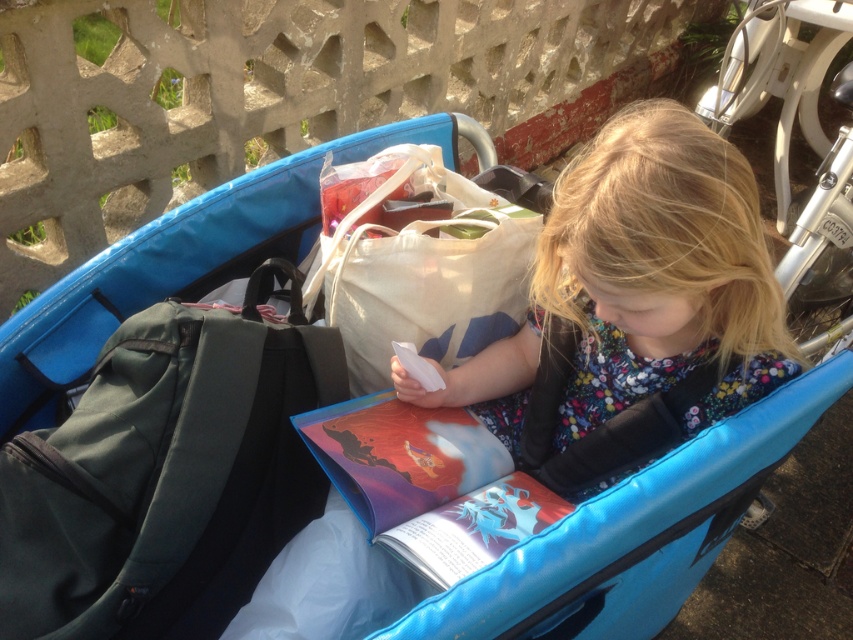
Who is shorter, dark green fabric backpack at left or hardcover book at center?

With less height is hardcover book at center.

Does dark green fabric backpack at left appear under hardcover book at center?

Actually, dark green fabric backpack at left is above hardcover book at center.

Is point (204, 573) positioned in front of point (329, 454)?

That is True.

Where is `dark green fabric backpack at left`? The height and width of the screenshot is (640, 853). dark green fabric backpack at left is located at coordinates (167, 476).

Can you confirm if canvas tote bag at center is taller than hardcover book at center?

Correct, canvas tote bag at center is much taller as hardcover book at center.

Is the position of canvas tote bag at center less distant than that of hardcover book at center?

No, canvas tote bag at center is behind hardcover book at center.

Find the location of a particular element. The height and width of the screenshot is (640, 853). canvas tote bag at center is located at coordinates (422, 275).

Is dark green fabric backpack at left to the left of floral fabric dress at center from the viewer's perspective?

Indeed, dark green fabric backpack at left is positioned on the left side of floral fabric dress at center.

Does dark green fabric backpack at left have a greater height compared to floral fabric dress at center?

In fact, dark green fabric backpack at left may be shorter than floral fabric dress at center.

Who is more distant from viewer, [254,330] or [724,289]?

Point [254,330]

Locate an element on the screen. dark green fabric backpack at left is located at coordinates (167, 476).